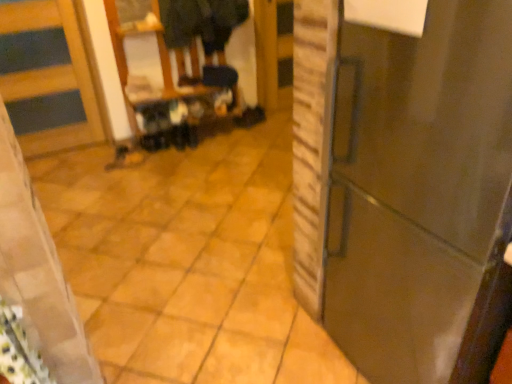
The width and height of the screenshot is (512, 384). What do you see at coordinates (52, 75) in the screenshot? I see `wooden door at left, the first door positioned from the left` at bounding box center [52, 75].

The image size is (512, 384). In order to click on matte black step stool at center in this screenshot , I will do `click(220, 76)`.

This screenshot has width=512, height=384. What do you see at coordinates (422, 196) in the screenshot? I see `glossy dark brown door at right, acting as the 2th door starting from the back` at bounding box center [422, 196].

Where is `glossy dark brown door at right, positioned as the second door in left-to-right order`? glossy dark brown door at right, positioned as the second door in left-to-right order is located at coordinates (422, 196).

Find the location of a particular element. This screenshot has width=512, height=384. wooden door at left, which is counted as the second door, starting from the front is located at coordinates (52, 75).

Considering the relative positions of wooden door at left, which is counted as the second door, starting from the front, and matte black step stool at center in the image provided, is wooden door at left, which is counted as the second door, starting from the front, to the left of matte black step stool at center from the viewer's perspective?

Yes.

Is wooden door at left, which is counted as the second door, starting from the front, next to matte black step stool at center?

wooden door at left, which is counted as the second door, starting from the front, is not next to matte black step stool at center, and they're not touching.

Is wooden door at left, acting as the second door starting from the right, closer to camera compared to matte black step stool at center?

Yes, wooden door at left, acting as the second door starting from the right, is closer to the viewer.

Between point (41, 152) and point (234, 77), which one is positioned in front?

Point (41, 152)

Measure the distance between dark fabric coat at upper center and glossy dark brown door at right, acting as the 2th door starting from the back.

dark fabric coat at upper center and glossy dark brown door at right, acting as the 2th door starting from the back, are 8.05 feet apart.

Is dark fabric coat at upper center turned away from glossy dark brown door at right, acting as the 2th door starting from the back?

dark fabric coat at upper center is not turned away from glossy dark brown door at right, acting as the 2th door starting from the back.

Is dark fabric coat at upper center outside of glossy dark brown door at right, which is counted as the first door, starting from the front?

Yes.

Which of these two, dark fabric coat at upper center or glossy dark brown door at right, which is counted as the first door, starting from the front, is bigger?

glossy dark brown door at right, which is counted as the first door, starting from the front, is bigger.

From the image's perspective, who appears lower, glossy dark brown door at right, positioned as the second door in left-to-right order, or wooden door at left, which is the first door in back-to-front order?

From the image's view, glossy dark brown door at right, positioned as the second door in left-to-right order, is below.

Looking at this image, is glossy dark brown door at right, positioned as the second door in left-to-right order, wider than wooden door at left, acting as the second door starting from the right?

Yes.

Is glossy dark brown door at right, positioned as the second door in left-to-right order, in front of or behind wooden door at left, which is the first door in back-to-front order, in the image?

In the image, glossy dark brown door at right, positioned as the second door in left-to-right order, appears in front of wooden door at left, which is the first door in back-to-front order.

Can you confirm if dark fabric coat at upper center is wider than wooden door at left, which is the first door in back-to-front order?

Indeed, dark fabric coat at upper center has a greater width compared to wooden door at left, which is the first door in back-to-front order.

This screenshot has width=512, height=384. I want to click on door on the left of dark fabric coat at upper center, so click(x=52, y=75).

Does dark fabric coat at upper center have a larger size compared to wooden door at left, which is counted as the second door, starting from the front?

Correct, dark fabric coat at upper center is larger in size than wooden door at left, which is counted as the second door, starting from the front.

Do you think dark fabric coat at upper center is within wooden door at left, acting as the second door starting from the right, or outside of it?

dark fabric coat at upper center is located beyond the bounds of wooden door at left, acting as the second door starting from the right.

Is matte black step stool at center not within wooden door at left, acting as the second door starting from the right?

matte black step stool at center lies outside wooden door at left, acting as the second door starting from the right,'s area.

Is matte black step stool at center wider than wooden door at left, acting as the second door starting from the right?

Yes.

Considering the positions of points (217, 74) and (47, 27), is point (217, 74) farther from camera compared to point (47, 27)?

Yes.

Considering their positions, is matte black step stool at center located in front of or behind wooden door at left, which is the first door in back-to-front order?

In the image, matte black step stool at center appears behind wooden door at left, which is the first door in back-to-front order.

Based on the photo, could you tell me if matte black shoe at center is turned towards dark fabric coat at upper center?

No, matte black shoe at center is not facing towards dark fabric coat at upper center.

Is matte black shoe at center beside dark fabric coat at upper center?

matte black shoe at center is not next to dark fabric coat at upper center, and they're not touching.

Does matte black shoe at center have a lesser width compared to dark fabric coat at upper center?

Yes.

Considering the sizes of matte black shoe at center and dark fabric coat at upper center in the image, is matte black shoe at center taller or shorter than dark fabric coat at upper center?

Clearly, matte black shoe at center is shorter compared to dark fabric coat at upper center.

Is dark fabric coat at upper center at the left side of matte black step stool at center?

Correct, you'll find dark fabric coat at upper center to the left of matte black step stool at center.

Can you tell me how much dark fabric coat at upper center and matte black step stool at center differ in facing direction?

They differ by 0.000321 degrees in their facing directions.

Is dark fabric coat at upper center with matte black step stool at center?

No, dark fabric coat at upper center is not with matte black step stool at center.

This screenshot has height=384, width=512. In order to click on couple above the matte black step stool at center (from the image's perspective) in this screenshot , I will do `click(201, 25)`.

I want to click on step stool beneath the wooden door at left, which is counted as the second door, starting from the front (from a real-world perspective), so click(220, 76).

Identify the location of door that is the 2nd object located below the dark fabric coat at upper center (from the image's perspective). The width and height of the screenshot is (512, 384). (422, 196).

When comparing their distances from matte black shoe at center, does glossy dark brown door at right, positioned as the second door in left-to-right order, or wooden door at left, the first door positioned from the left, seem closer?

The object closer to matte black shoe at center is wooden door at left, the first door positioned from the left.

From the picture: Which object lies nearer to the anchor point matte black step stool at center, wooden door at left, which is counted as the second door, starting from the front, or glossy dark brown door at right, acting as the 2th door starting from the back?

Based on the image, wooden door at left, which is counted as the second door, starting from the front, appears to be nearer to matte black step stool at center.

When comparing their distances from wooden door at left, the first door positioned from the left, does glossy dark brown door at right, which is counted as the first door, starting from the front, or dark fabric coat at upper center seem further?

glossy dark brown door at right, which is counted as the first door, starting from the front, lies further to wooden door at left, the first door positioned from the left, than the other object.

From the image, which object appears to be nearer to matte black shoe at center, dark fabric coat at upper center or glossy dark brown door at right, acting as the 2th door starting from the back?

Based on the image, dark fabric coat at upper center appears to be nearer to matte black shoe at center.

Based on their spatial positions, is dark fabric coat at upper center or glossy dark brown door at right, acting as the 2th door starting from the back, further from wooden door at left, which is counted as the second door, starting from the front?

The object further to wooden door at left, which is counted as the second door, starting from the front, is glossy dark brown door at right, acting as the 2th door starting from the back.

When comparing their distances from dark fabric coat at upper center, does matte black step stool at center or matte black shoe at center seem further?

Among the two, matte black shoe at center is located further to dark fabric coat at upper center.

When comparing their distances from matte black step stool at center, does matte black shoe at center or glossy dark brown door at right, positioned as the second door in left-to-right order, seem further?

Based on the image, glossy dark brown door at right, positioned as the second door in left-to-right order, appears to be further to matte black step stool at center.

Consider the image. When comparing their distances from matte black step stool at center, does glossy dark brown door at right, acting as the 2th door starting from the back, or wooden door at left, the first door positioned from the left, seem further?

glossy dark brown door at right, acting as the 2th door starting from the back, is positioned further to the anchor matte black step stool at center.

This screenshot has height=384, width=512. I want to click on step stool between dark fabric coat at upper center and matte black shoe at center along the z-axis, so click(x=220, y=76).

At what (x,y) coordinates should I click in order to perform the action: click on step stool located between glossy dark brown door at right, acting as the 2th door starting from the back, and matte black shoe at center in the depth direction. Please return your answer as a coordinate pair (x, y). Image resolution: width=512 pixels, height=384 pixels. Looking at the image, I should click on (220, 76).

What are the coordinates of `shoe between wooden door at left, which is the first door in back-to-front order, and matte black step stool at center, in the horizontal direction` in the screenshot? It's located at (189, 80).

Find the location of `door between glossy dark brown door at right, acting as the 2th door starting from the back, and matte black shoe at center from front to back`. door between glossy dark brown door at right, acting as the 2th door starting from the back, and matte black shoe at center from front to back is located at coordinates click(52, 75).